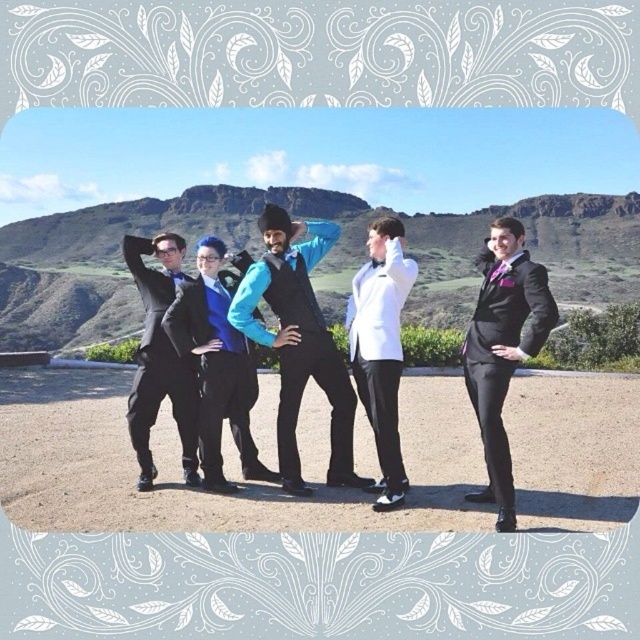
Question: Considering the real-world distances, which object is closest to the shiny black suit at right?

Choices:
 (A) matte blue vest at center
 (B) white satin tuxedo at center
 (C) matte black suit at left
 (D) blue satin shirt at center

Answer: (B)

Question: Is the position of shiny black suit at right more distant than that of blue satin shirt at center?

Choices:
 (A) yes
 (B) no

Answer: (B)

Question: Which object is farther from the camera taking this photo?

Choices:
 (A) blue satin shirt at center
 (B) shiny black suit at right
 (C) matte black suit at left
 (D) white satin tuxedo at center

Answer: (A)

Question: Which is nearer to the matte blue vest at center?

Choices:
 (A) blue satin shirt at center
 (B) matte black suit at left

Answer: (A)

Question: Does shiny black suit at right have a greater width compared to blue satin shirt at center?

Choices:
 (A) yes
 (B) no

Answer: (B)

Question: Observing the image, what is the correct spatial positioning of matte blue vest at center in reference to white satin tuxedo at center?

Choices:
 (A) below
 (B) above

Answer: (B)